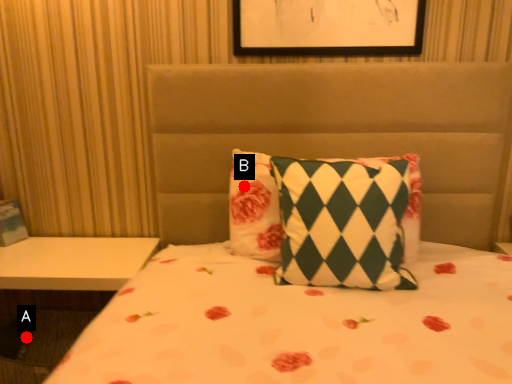
Question: Two points are circled on the image, labeled by A and B beside each circle. Which of the following is the closest to the observer?

Choices:
 (A) A is closer
 (B) B is closer

Answer: (B)